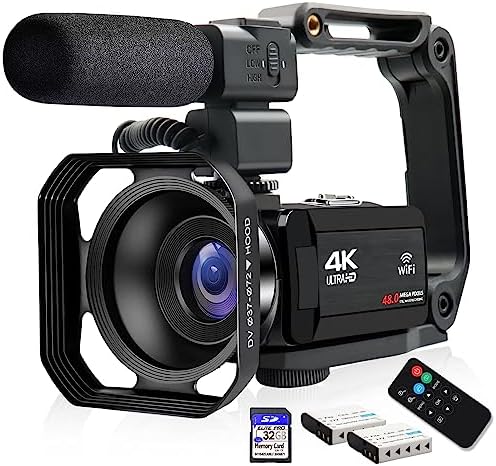
You are a GUI agent. You are given a task and a screenshot of the screen. Output one action in this format:
    pyautogui.click(x=<x>, y=<y>)
    Task: Click on the remote
    The height and width of the screenshot is (466, 496).
    Given the screenshot: What is the action you would take?
    pyautogui.click(x=467, y=414)